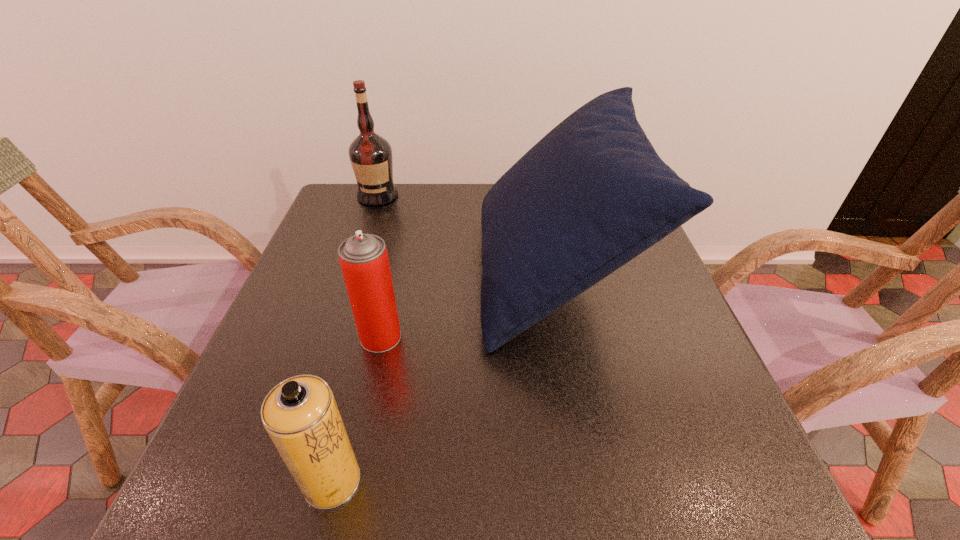
At what (x,y) coordinates should I click in order to perform the action: click on the rightmost object. Please return your answer as a coordinate pair (x, y). This screenshot has width=960, height=540. Looking at the image, I should click on (591, 195).

Locate an element on the screen. The width and height of the screenshot is (960, 540). the farthest object is located at coordinates (370, 155).

Find the location of a particular element. the farther aerosol can is located at coordinates pos(364,261).

At what (x,y) coordinates should I click in order to perform the action: click on the nearest object. Please return your answer as a coordinate pair (x, y). This screenshot has width=960, height=540. Looking at the image, I should click on (300, 414).

The height and width of the screenshot is (540, 960). I want to click on vacant space located on the facing side of the rightmost object, so click(x=359, y=274).

Where is `free location located 0.280m on the facing side of the rightmost object`? This screenshot has height=540, width=960. free location located 0.280m on the facing side of the rightmost object is located at coordinates (364, 274).

Locate an element on the screen. The width and height of the screenshot is (960, 540). free space located on the facing side of the rightmost object is located at coordinates (393, 274).

In order to click on free space located 0.400m on the surface of the liquor in this screenshot , I will do `click(342, 303)`.

This screenshot has width=960, height=540. Find the location of `free space located 0.130m on the front of the farther aerosol can`. free space located 0.130m on the front of the farther aerosol can is located at coordinates (364, 411).

Identify the location of free spot located 0.140m on the right of the nearest object. (450, 481).